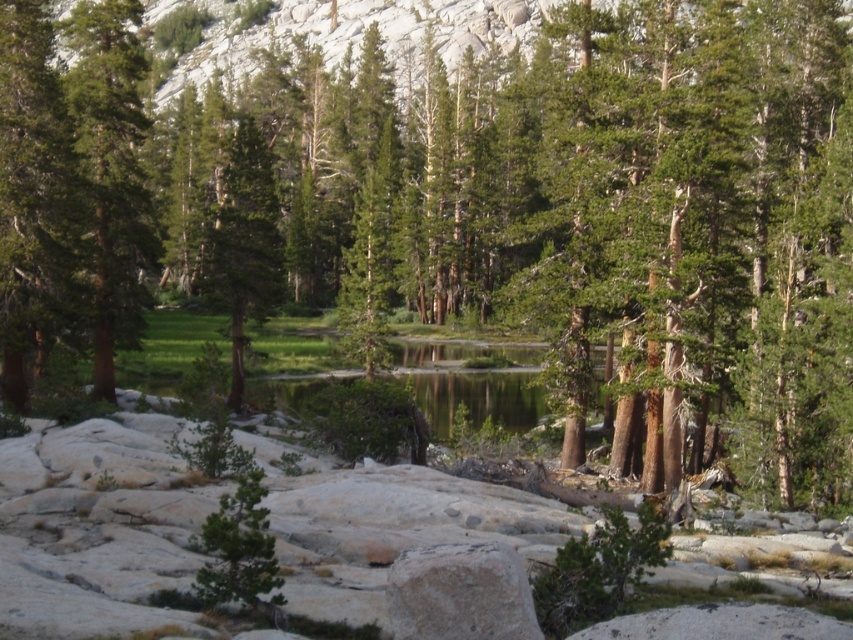
Is green matte tree at left above green matte tree at center?

Actually, green matte tree at left is below green matte tree at center.

Is point (102, 353) positioned behind point (234, 296)?

That is False.

Where is `green matte tree at left`? green matte tree at left is located at coordinates (109, 172).